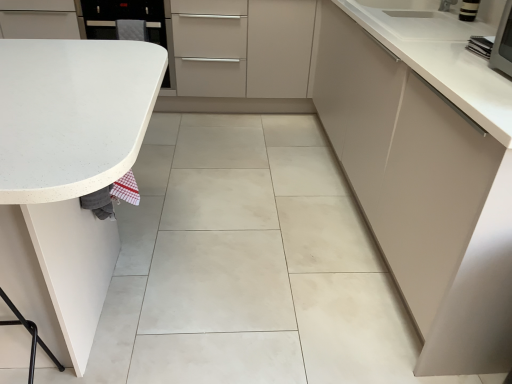
Question: From a real-world perspective, is white speckled laminate countertop at left, the first countertop when ordered from bottom to top, physically located above or below white glossy countertop at upper right, the second countertop when ordered from left to right?

Choices:
 (A) below
 (B) above

Answer: (A)

Question: Is white speckled laminate countertop at left, which ranks as the second countertop in right-to-left order, bigger or smaller than white glossy countertop at upper right, marked as the second countertop in a bottom-to-top arrangement?

Choices:
 (A) big
 (B) small

Answer: (A)

Question: Estimate the real-world distances between objects in this image. Which object is farther from the white glossy countertop at upper right, the first countertop from the top?

Choices:
 (A) white speckled laminate countertop at left, which ranks as the second countertop in right-to-left order
 (B) matte white cabinet at right
 (C) white glossy oven at upper left

Answer: (C)

Question: Which of these objects is positioned closest to the white glossy countertop at upper right, the second countertop when ordered from left to right?

Choices:
 (A) white glossy oven at upper left
 (B) white speckled laminate countertop at left, arranged as the second countertop when viewed from the top
 (C) matte white cabinet at right

Answer: (C)